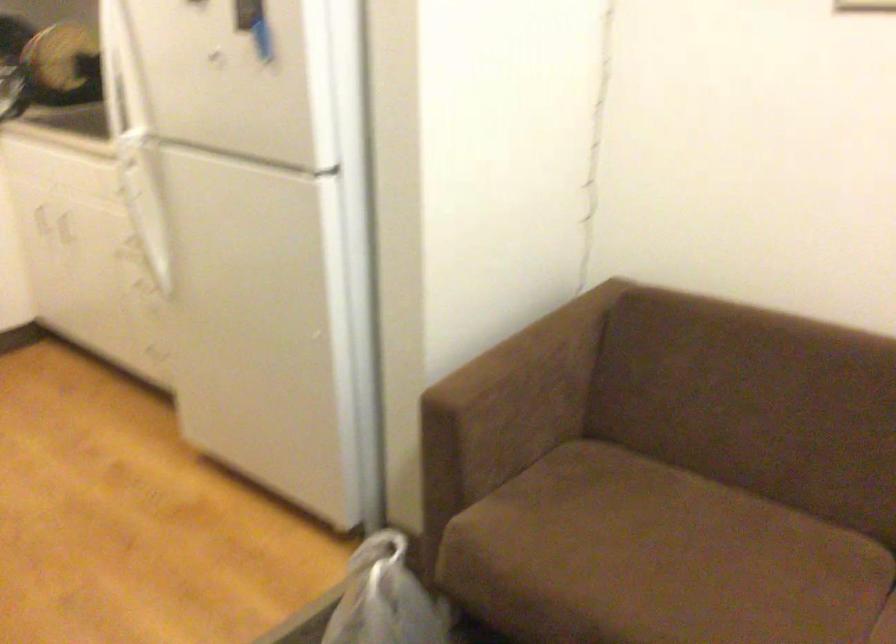
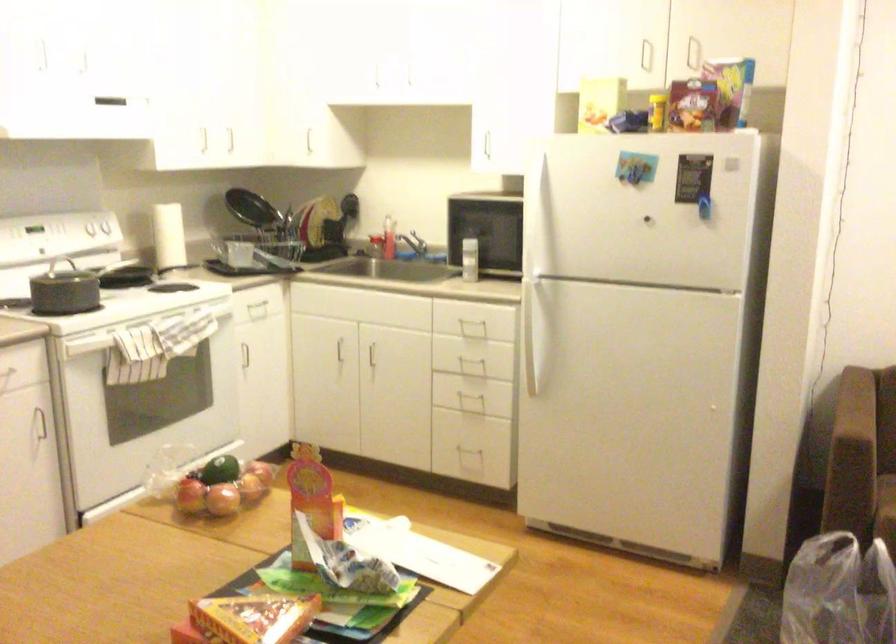
In the second image, find the point that corresponds to pixel 449 422 in the first image.

(879, 446)